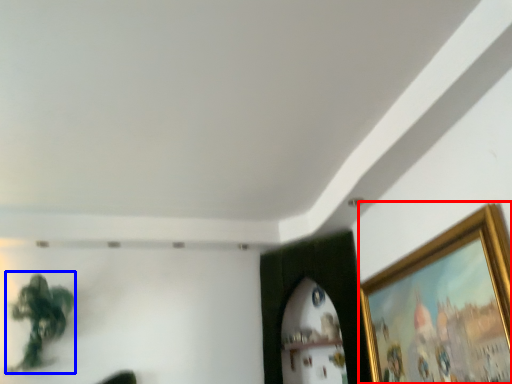
Question: Which of the following is the closest to the observer, picture frame (highlighted by a red box) or plant (highlighted by a blue box)?

Choices:
 (A) picture frame
 (B) plant

Answer: (A)